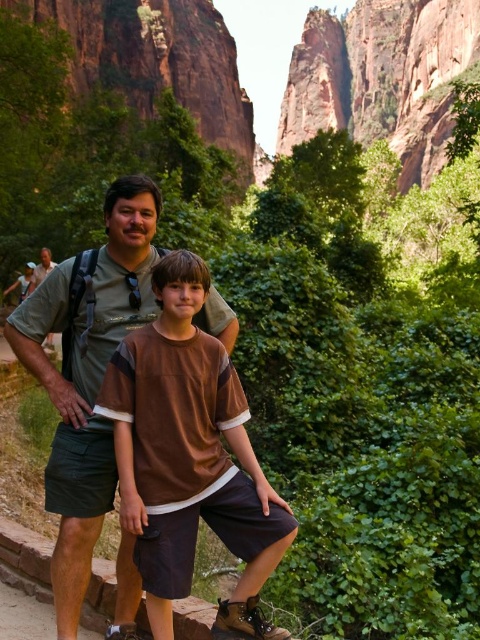
Is brown cotton shirt at center taller than green fabric shirt at center?

In fact, brown cotton shirt at center may be shorter than green fabric shirt at center.

Image resolution: width=480 pixels, height=640 pixels. What do you see at coordinates (190, 458) in the screenshot? I see `brown cotton shirt at center` at bounding box center [190, 458].

I want to click on brown cotton shirt at center, so 190,458.